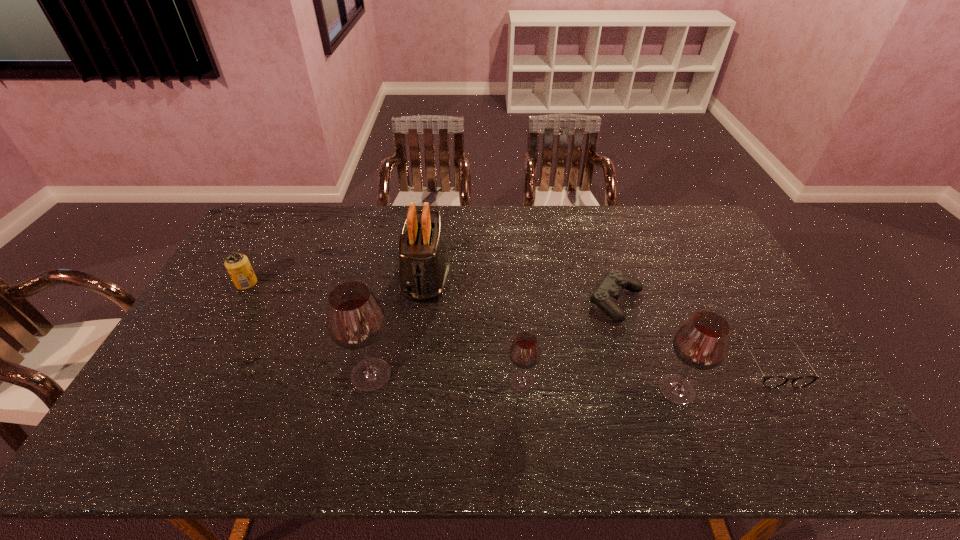
Find the location of `free space that satisfies the following two spatial constraints: 1. on the back side of the leftmost wineglass; 2. on the right side of the control`. free space that satisfies the following two spatial constraints: 1. on the back side of the leftmost wineglass; 2. on the right side of the control is located at coordinates (387, 302).

The height and width of the screenshot is (540, 960). I want to click on free space that satisfies the following two spatial constraints: 1. on the side of the toaster with the control lever; 2. on the right side of the control, so click(x=422, y=302).